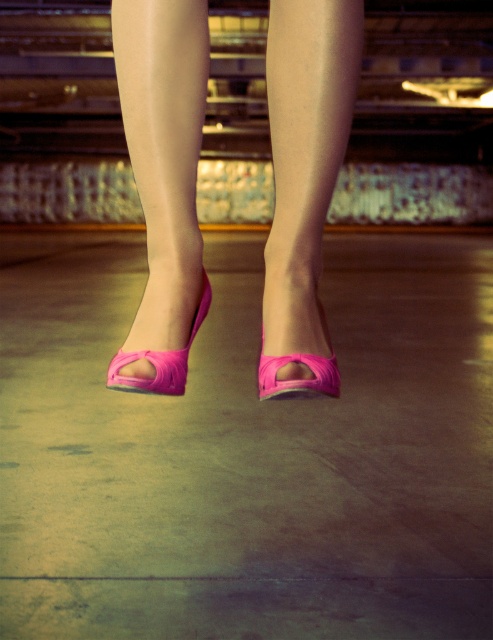
You are a photographer adjusting the lighting for a shoot. You notice the neon pink satin sandal at lower center and the pink matte toe at center. Which object should you focus on to highlight the texture differences between the two?

The neon pink satin sandal at lower center has a glossy surface, while the pink matte toe at center has a nonreflective finish. To emphasize their contrasting textures, focus on the neon pink satin sandal at lower center to showcase its shiny satin material and the pink matte toe at center to display its matte texture.